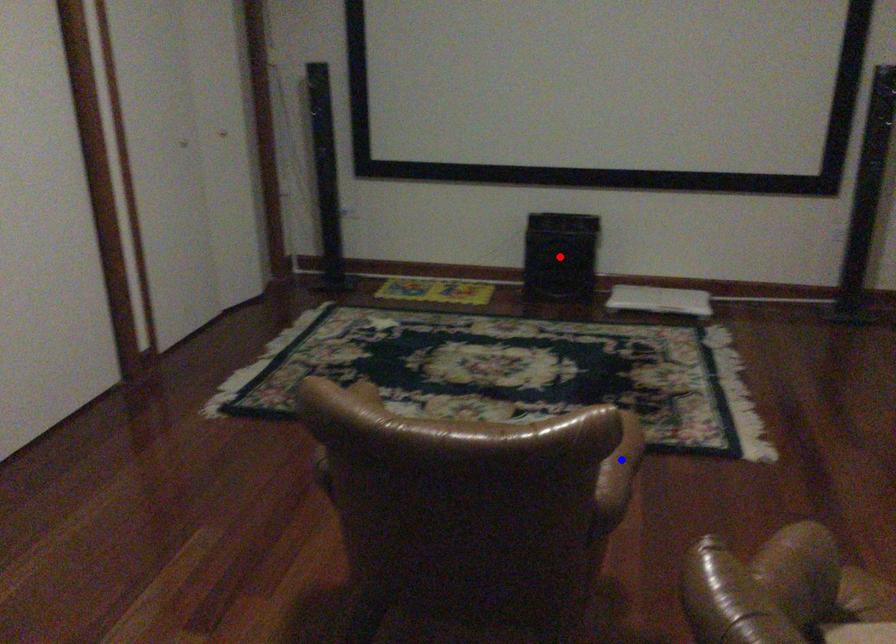
Question: Which of the two points in the image is closer to the camera?

Choices:
 (A) Blue point is closer.
 (B) Red point is closer.

Answer: (A)